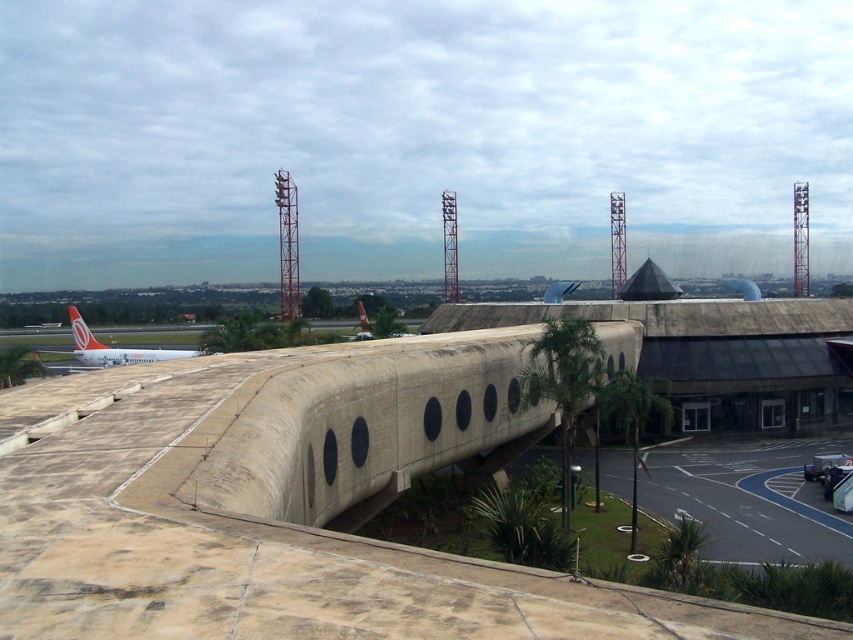
Between point (543, 456) and point (641, 426), which one is positioned in front?

Point (641, 426) is in front.

Is black asphalt at lower right behind green leafy palm tree at lower right?

No, black asphalt at lower right is closer to the viewer.

The height and width of the screenshot is (640, 853). I want to click on black asphalt at lower right, so click(749, 496).

Between black asphalt at lower right and green leafy palm tree at center, which one has more height?

green leafy palm tree at center

The width and height of the screenshot is (853, 640). Find the location of `black asphalt at lower right`. black asphalt at lower right is located at coordinates (749, 496).

Is point (606, 476) closer to camera compared to point (535, 397)?

No, (606, 476) is behind (535, 397).

Identify the location of black asphalt at lower right. (749, 496).

Between point (573, 365) and point (663, 419), which one is positioned in front?

Point (573, 365) is in front.

Which is below, green leafy palm tree at center or green leafy palm tree at lower right?

green leafy palm tree at lower right is lower down.

Is point (564, 340) positioned before point (627, 381)?

That is True.

Locate an element on the screen. green leafy palm tree at center is located at coordinates (563, 381).